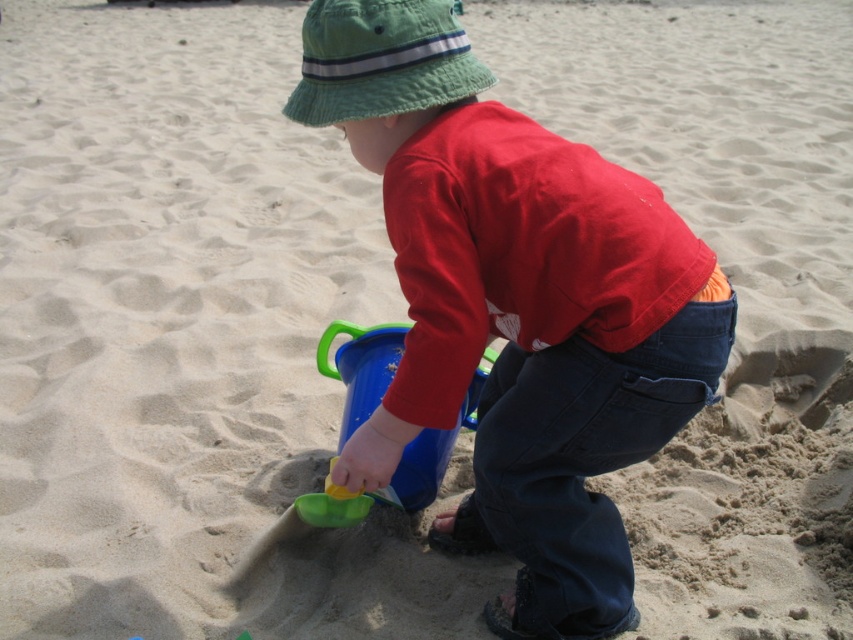
Which is more to the left, green fabric hat at upper center or green plastic bucket at center?

green plastic bucket at center

Does green fabric hat at upper center appear on the right side of green plastic bucket at center?

Correct, you'll find green fabric hat at upper center to the right of green plastic bucket at center.

The image size is (853, 640). I want to click on green fabric hat at upper center, so click(x=381, y=60).

This screenshot has height=640, width=853. Identify the location of green fabric hat at upper center. (381, 60).

Does matte blue bucket at center have a lesser width compared to green plastic bucket at center?

Incorrect, matte blue bucket at center's width is not less than green plastic bucket at center's.

The image size is (853, 640). Find the location of `matte blue bucket at center`. matte blue bucket at center is located at coordinates (515, 307).

This screenshot has width=853, height=640. What do you see at coordinates (515, 307) in the screenshot?
I see `matte blue bucket at center` at bounding box center [515, 307].

Image resolution: width=853 pixels, height=640 pixels. What are the coordinates of `matte blue bucket at center` in the screenshot? It's located at (515, 307).

Which of these two, matte blue bucket at center or green fabric hat at upper center, stands shorter?

Standing shorter between the two is green fabric hat at upper center.

From the picture: Is matte blue bucket at center smaller than green fabric hat at upper center?

Actually, matte blue bucket at center might be larger than green fabric hat at upper center.

The height and width of the screenshot is (640, 853). I want to click on matte blue bucket at center, so click(x=515, y=307).